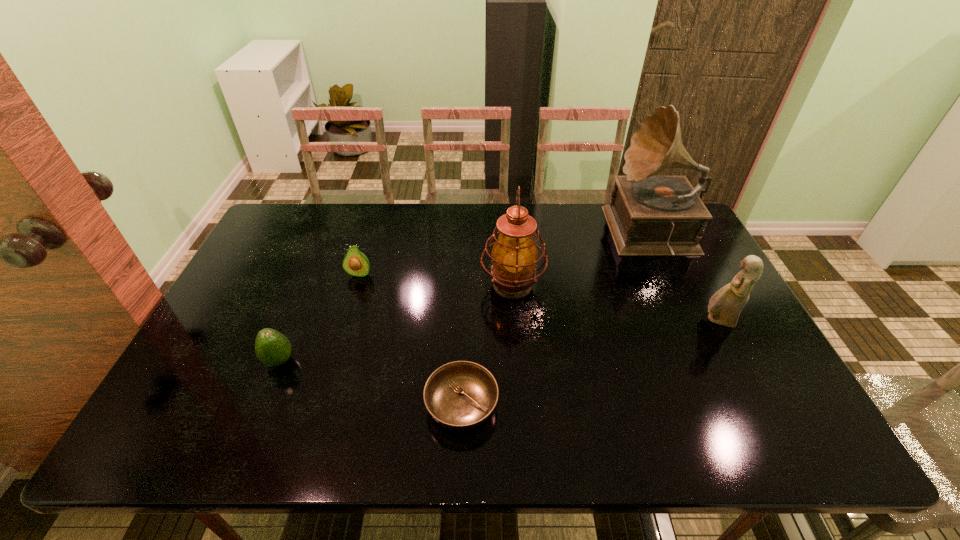
Identify the location of object that is at the far edge. (648, 215).

Identify the location of object at the near edge. Image resolution: width=960 pixels, height=540 pixels. tap(461, 395).

Identify the location of record player that is at the right edge. (648, 215).

At what (x,y) coordinates should I click in order to perform the action: click on figurine present at the right edge. Please return your answer as a coordinate pair (x, y). Looking at the image, I should click on (725, 306).

Locate an element on the screen. object that is at the far right corner is located at coordinates (648, 215).

Image resolution: width=960 pixels, height=540 pixels. In the image, there is a desktop. Identify the location of vacant space at the far edge. (420, 209).

In the image, there is a desktop. In order to click on vacant space at the near edge in this screenshot , I will do `click(634, 436)`.

The width and height of the screenshot is (960, 540). In order to click on free space at the right edge in this screenshot , I will do `click(762, 354)`.

Where is `vacant space in between the fifth object from right to left and the nearest object`? This screenshot has height=540, width=960. vacant space in between the fifth object from right to left and the nearest object is located at coordinates (411, 340).

The image size is (960, 540). What are the coordinates of `free space between the shortest object and the record player` in the screenshot? It's located at (558, 320).